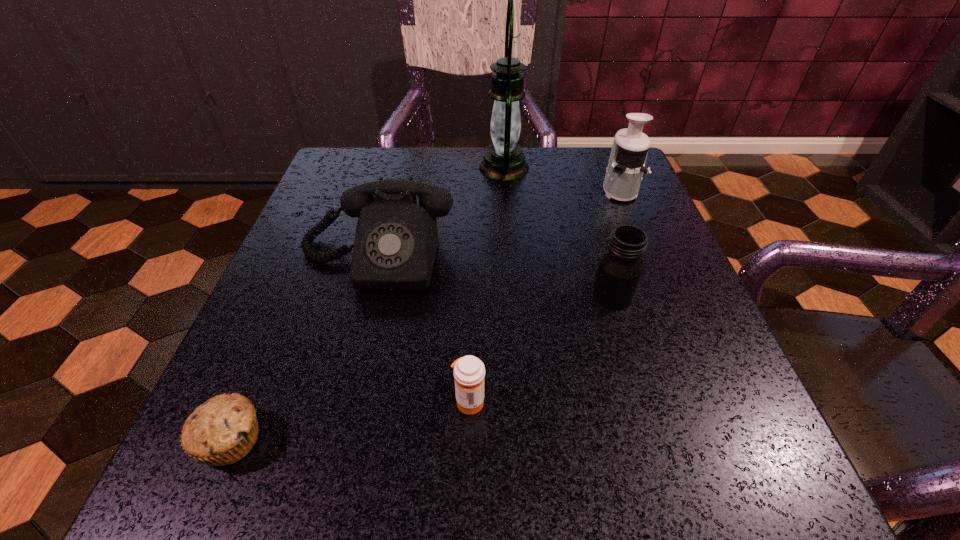
Identify the location of vacant space located on the front of the juicer. coord(631,219).

In order to click on blank space located on the dial of the telephone in this screenshot , I will do `click(330, 437)`.

Identify the location of free space located on the front of the fifth object from left to right. This screenshot has height=540, width=960. (657, 438).

Locate an element on the screen. free region located on the left of the medicine is located at coordinates (305, 401).

Image resolution: width=960 pixels, height=540 pixels. Find the location of `free space located 0.060m on the back of the shortest object`. free space located 0.060m on the back of the shortest object is located at coordinates (260, 372).

Locate an element on the screen. The image size is (960, 540). lantern present at the far edge is located at coordinates (504, 160).

Identify the location of juicer that is at the far edge. (626, 165).

Find the location of a particular element. This screenshot has width=960, height=540. object that is at the near edge is located at coordinates (221, 431).

At what (x,y) coordinates should I click in order to perform the action: click on telephone present at the left edge. Please return your answer as a coordinate pair (x, y). Looking at the image, I should click on (396, 240).

In order to click on muffin that is at the left edge in this screenshot , I will do `click(221, 431)`.